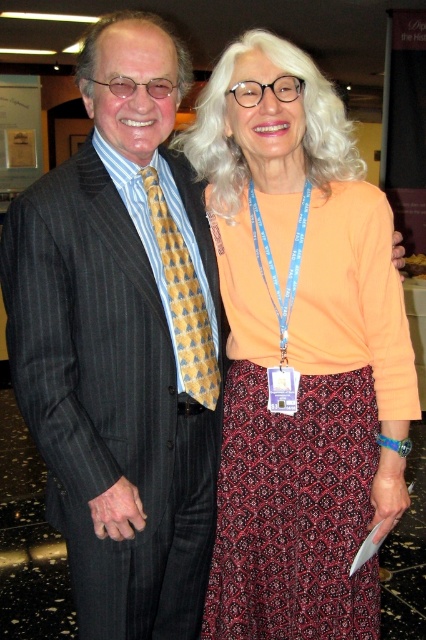
Can you confirm if matte black suit at center is positioned to the left of yellowpatterned fabrictie at center?

Indeed, matte black suit at center is positioned on the left side of yellowpatterned fabrictie at center.

Can you confirm if matte black suit at center is smaller than yellowpatterned fabrictie at center?

Actually, matte black suit at center might be larger than yellowpatterned fabrictie at center.

At what (x,y) coordinates should I click in order to perform the action: click on matte black suit at center. Please return your answer as a coordinate pair (x, y). The height and width of the screenshot is (640, 426). Looking at the image, I should click on (121, 342).

Does matte black suit at center have a lesser height compared to dark red patterned skirt at center?

No.

Which is more to the left, matte black suit at center or dark red patterned skirt at center?

matte black suit at center

Does point (89, 109) come closer to viewer compared to point (310, 577)?

Yes, it is in front of point (310, 577).

Where is `matte black suit at center`? This screenshot has height=640, width=426. matte black suit at center is located at coordinates (121, 342).

Image resolution: width=426 pixels, height=640 pixels. I want to click on matte orange blouse at center, so click(x=299, y=352).

Who is shorter, matte orange blouse at center or dark red patterned skirt at center?

dark red patterned skirt at center

Is point (236, 99) behind point (342, 534)?

No, it is not.

Locate an element on the screen. The image size is (426, 640). matte orange blouse at center is located at coordinates (299, 352).